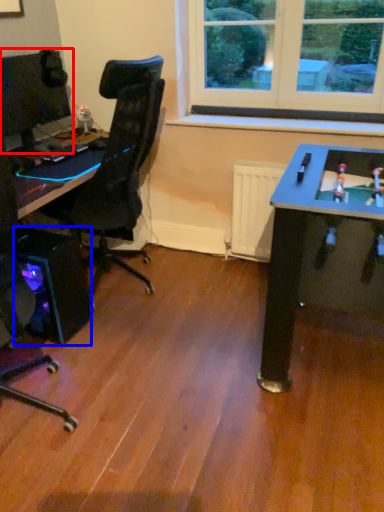
Question: Which object is closer to the camera taking this photo, computer monitor (highlighted by a red box) or computer tower (highlighted by a blue box)?

Choices:
 (A) computer monitor
 (B) computer tower

Answer: (B)